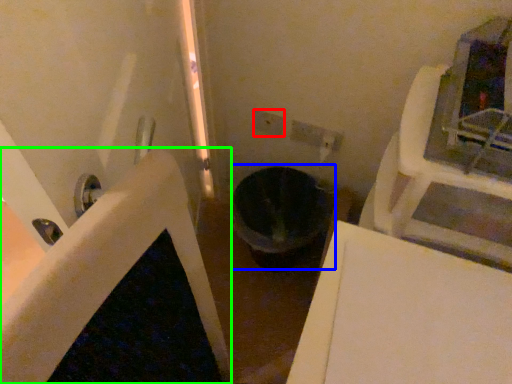
Question: Which object is the closest to the electric outlet (highlighted by a red box)? Choose among these: toilet bowl (highlighted by a blue box) or bath (highlighted by a green box).

Choices:
 (A) toilet bowl
 (B) bath

Answer: (A)